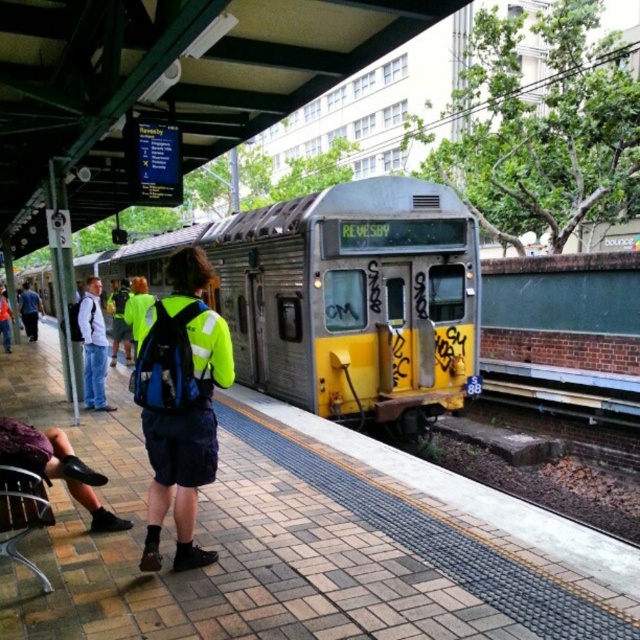
Question: Which point is farther from the camera taking this photo?

Choices:
 (A) (358, 204)
 (B) (93, 374)

Answer: (A)

Question: Which point is farther to the camera?

Choices:
 (A) (394, 273)
 (B) (84, 314)

Answer: (A)

Question: From the image, what is the correct spatial relationship of yellow metallic train at center in relation to light blue jeans at left?

Choices:
 (A) above
 (B) below

Answer: (A)

Question: Can you confirm if yellow metallic train at center is bigger than light blue jeans at left?

Choices:
 (A) no
 (B) yes

Answer: (B)

Question: Which point is closer to the camera taking this photo?

Choices:
 (A) (369, 273)
 (B) (81, 340)

Answer: (B)

Question: Does yellow metallic train at center have a smaller size compared to light blue jeans at left?

Choices:
 (A) yes
 (B) no

Answer: (B)